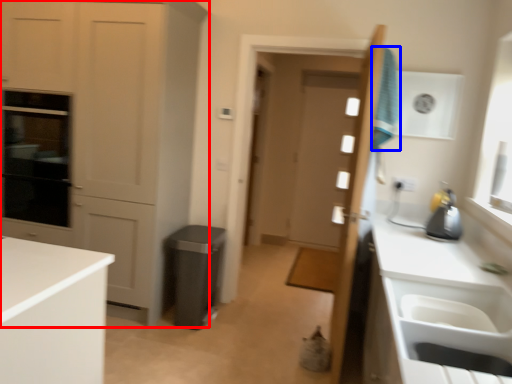
Question: Which of the following is the farthest to the observer, cabinetry (highlighted by a red box) or laundry (highlighted by a blue box)?

Choices:
 (A) cabinetry
 (B) laundry

Answer: (A)